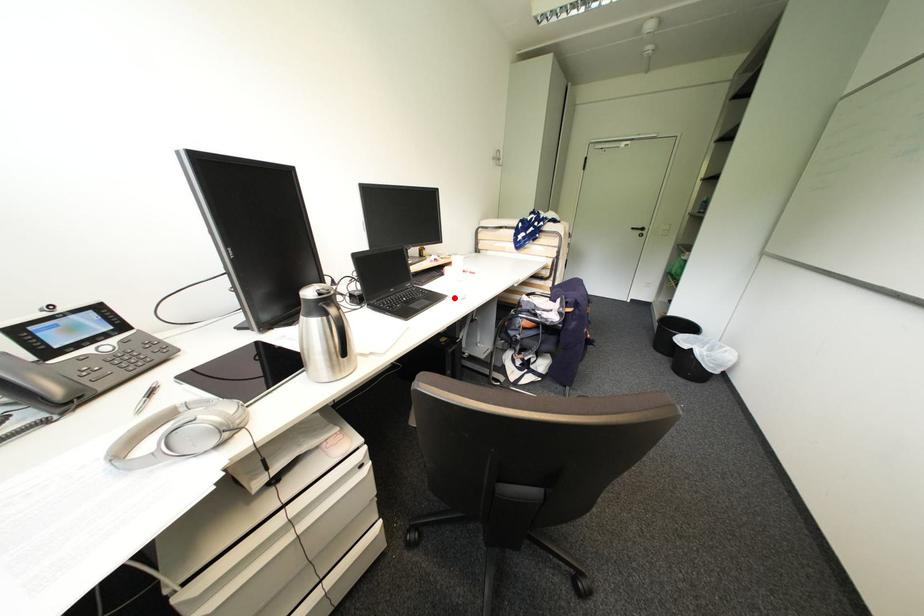
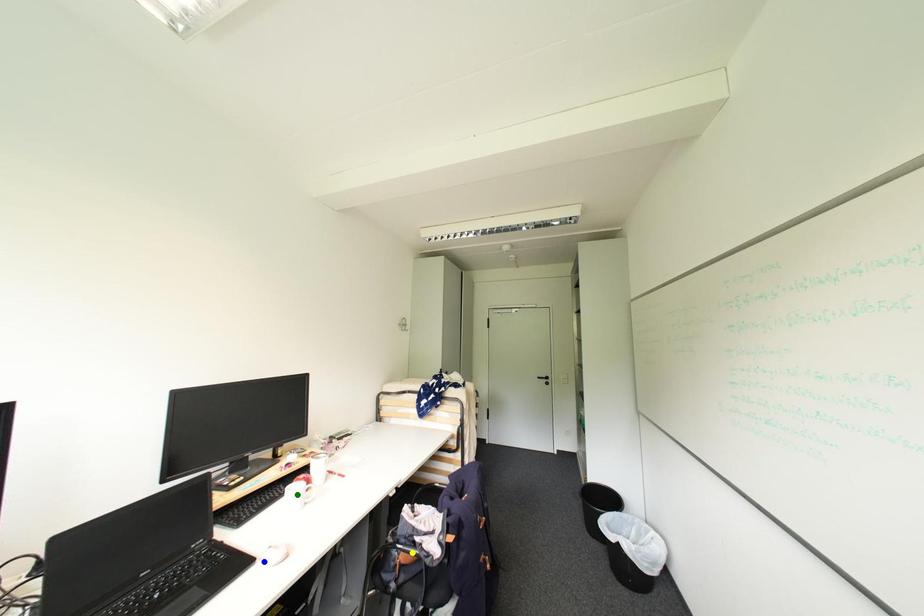
Question: I am providing you with two images of the same scene from different viewpoints. A red point is marked on the first image. You are given multiple points on the second image. Which spot in image 2 lines up with the point in image 1?

Choices:
 (A) blue point
 (B) yellow point
 (C) green point

Answer: (A)